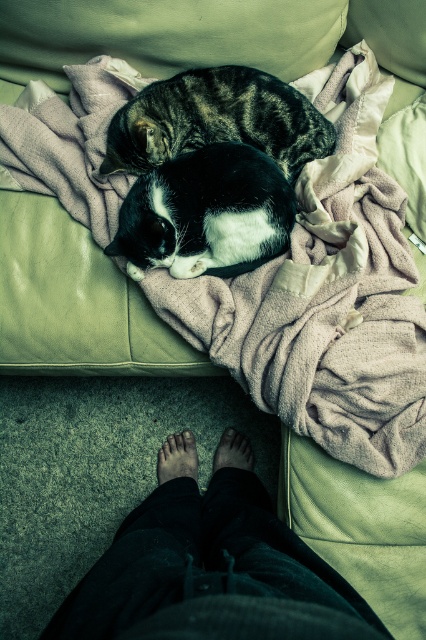
Does dark blue jeans at lower center come behind smooth skin foot at lower center?

No, it is in front of smooth skin foot at lower center.

Does dark blue jeans at lower center have a smaller size compared to smooth skin foot at lower center?

Actually, dark blue jeans at lower center might be larger than smooth skin foot at lower center.

Who is more forward, (117, 618) or (192, 474)?

Point (117, 618) is in front.

In order to click on dark blue jeans at lower center in this screenshot , I will do `click(210, 573)`.

Is smooth skin foot at lower center further to camera compared to brown matte foot at lower center?

No, it is not.

Does smooth skin foot at lower center have a greater width compared to brown matte foot at lower center?

Yes.

In order to click on smooth skin foot at lower center in this screenshot , I will do `click(178, 458)`.

Can you confirm if dark blue jeans at lower center is bigger than brown matte foot at lower center?

Correct, dark blue jeans at lower center is larger in size than brown matte foot at lower center.

Is dark blue jeans at lower center shorter than brown matte foot at lower center?

In fact, dark blue jeans at lower center may be taller than brown matte foot at lower center.

Is point (268, 564) positioned before point (235, 433)?

That is True.

Identify the location of dark blue jeans at lower center. (210, 573).